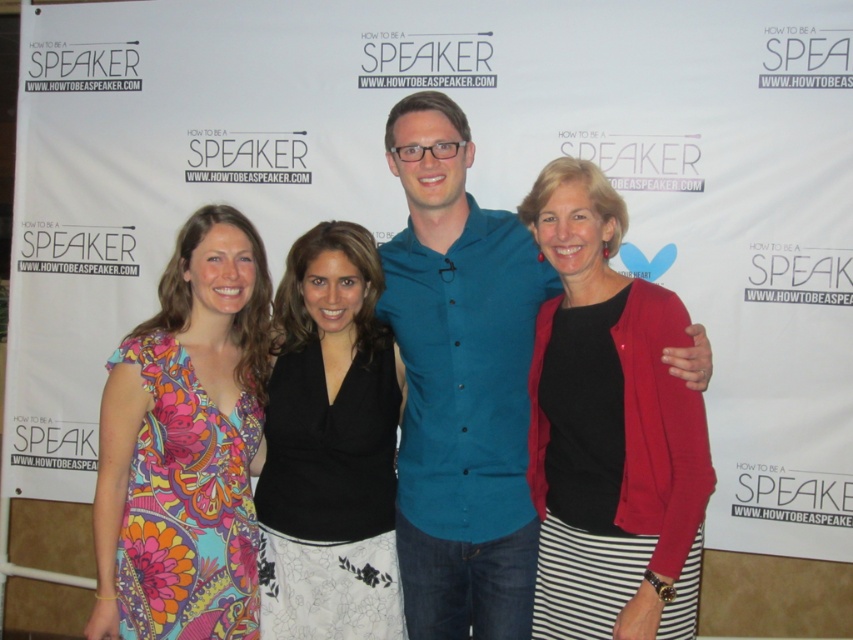
Based on the scene description, can you determine the spatial relationship between the floral print dress at left and the black jersey at center? Please explain using the provided details.

The floral print dress at left is located above the black jersey at center, meaning it is positioned higher up in the image compared to the black jersey.